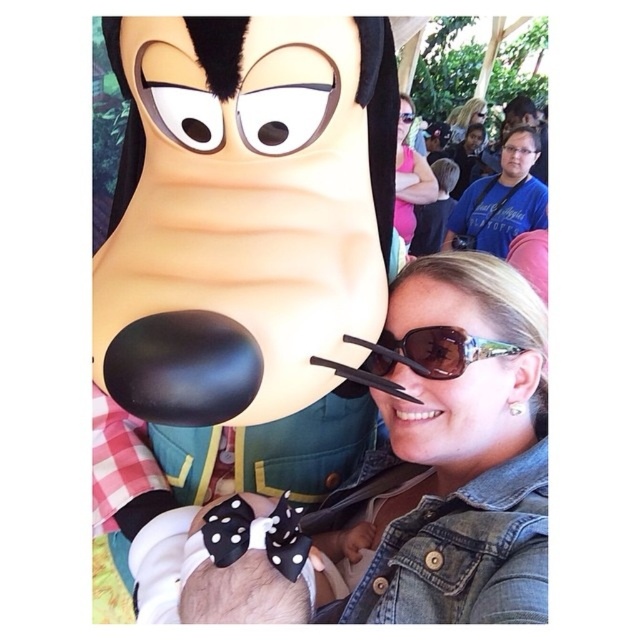
Question: Which object is the farthest from the matte pink shirt at upper right?

Choices:
 (A) denim jacket at lower right
 (B) brown reflective sunglasses at upper right
 (C) matte black sunglasses at upper center

Answer: (B)

Question: Considering the real-world distances, which object is closest to the black dotted fabric bow tie at lower center?

Choices:
 (A) denim jacket at lower right
 (B) black polka dot bow at center

Answer: (B)

Question: Among these objects, which one is farthest from the camera?

Choices:
 (A) brown reflective sunglasses at upper right
 (B) black dotted fabric bow tie at lower center

Answer: (A)

Question: Where is denim jacket at lower right located in relation to brown reflective sunglasses at upper right in the image?

Choices:
 (A) right
 (B) left

Answer: (A)

Question: Can you confirm if matte pink shirt at upper right is wider than matte black sunglasses at upper center?

Choices:
 (A) no
 (B) yes

Answer: (B)

Question: Does black polka dot bow at center have a lesser width compared to matte black sunglasses at upper center?

Choices:
 (A) no
 (B) yes

Answer: (A)